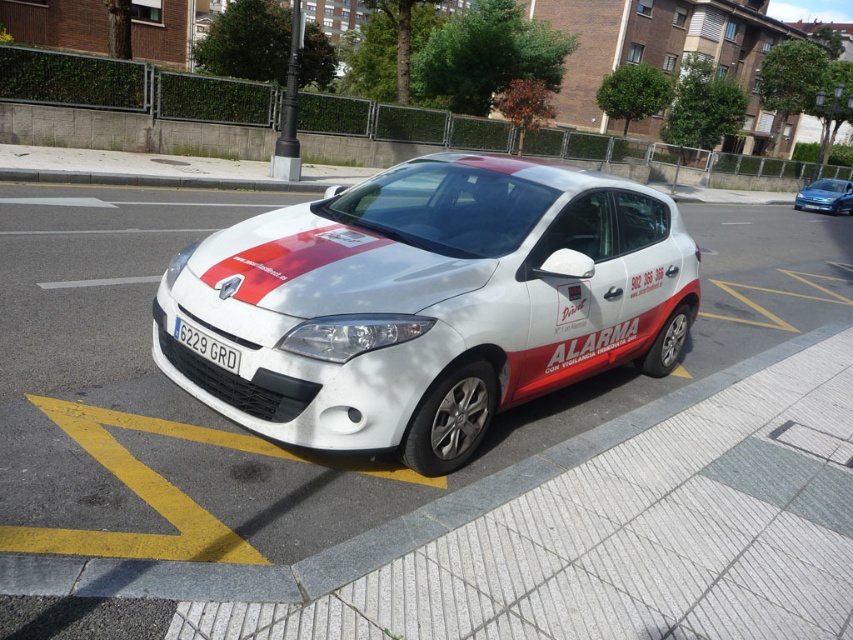
Which of these two, white glossy hatchback at center or white plastic license plate at center, stands shorter?

white plastic license plate at center

Is point (637, 342) more distant than point (206, 346)?

Yes, point (637, 342) is behind point (206, 346).

Where is `white glossy hatchback at center`? The image size is (853, 640). white glossy hatchback at center is located at coordinates (428, 301).

Is white matte hatchback at center above white plastic license plate at center?

Yes.

Can you confirm if white matte hatchback at center is positioned below white plastic license plate at center?

Incorrect, white matte hatchback at center is not positioned below white plastic license plate at center.

Between point (834, 202) and point (183, 336), which one is positioned behind?

Point (834, 202)

The width and height of the screenshot is (853, 640). What are the coordinates of `white matte hatchback at center` in the screenshot? It's located at (825, 196).

Does white glossy hatchback at center appear over white matte hatchback at center?

No, white glossy hatchback at center is not above white matte hatchback at center.

The image size is (853, 640). Describe the element at coordinates (428, 301) in the screenshot. I see `white glossy hatchback at center` at that location.

Measure the distance between point (457, 177) and camera.

Point (457, 177) is 13.96 feet from camera.

Where is `white glossy hatchback at center`? The image size is (853, 640). white glossy hatchback at center is located at coordinates (428, 301).